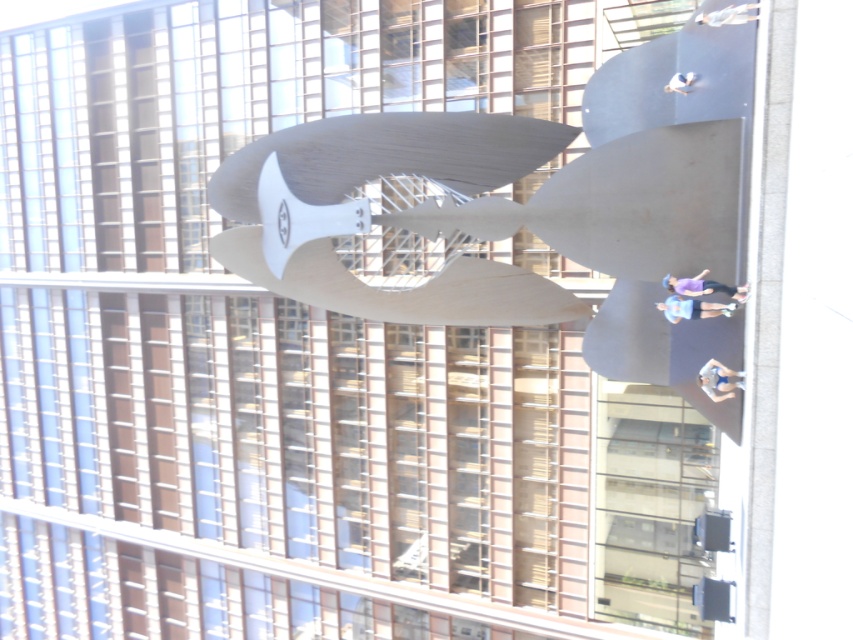
Question: In this image, where is light blue fabric at upper center located relative to white matte person at center?

Choices:
 (A) above
 (B) below

Answer: (A)

Question: Does polished silver sculpture at center have a greater width compared to light blue fabric at center?

Choices:
 (A) yes
 (B) no

Answer: (A)

Question: Which object is positioned closest to the light blue fabric at upper center?

Choices:
 (A) blue fabric shorts at lower right
 (B) white matte person at center
 (C) purple fabric person at center
 (D) light blue fabric at center

Answer: (B)

Question: Which object appears closest to the camera in this image?

Choices:
 (A) purple fabric person at center
 (B) white matte person at center
 (C) light blue fabric at center

Answer: (A)

Question: Observing the image, what is the correct spatial positioning of light blue fabric at center in reference to white matte person at center?

Choices:
 (A) right
 (B) left

Answer: (B)

Question: Which point is farther to the camera?

Choices:
 (A) (724, 291)
 (B) (674, 83)
 (C) (254, 234)

Answer: (C)